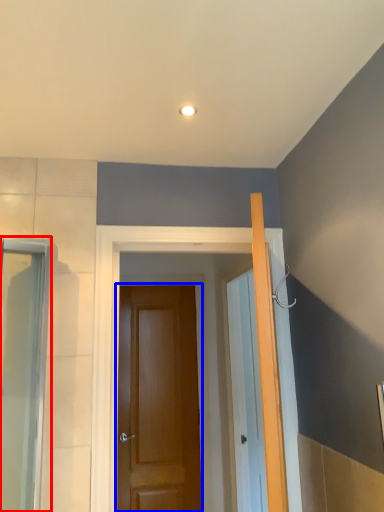
Question: Which object is closer to the camera taking this photo, screen door (highlighted by a red box) or door (highlighted by a blue box)?

Choices:
 (A) screen door
 (B) door

Answer: (A)